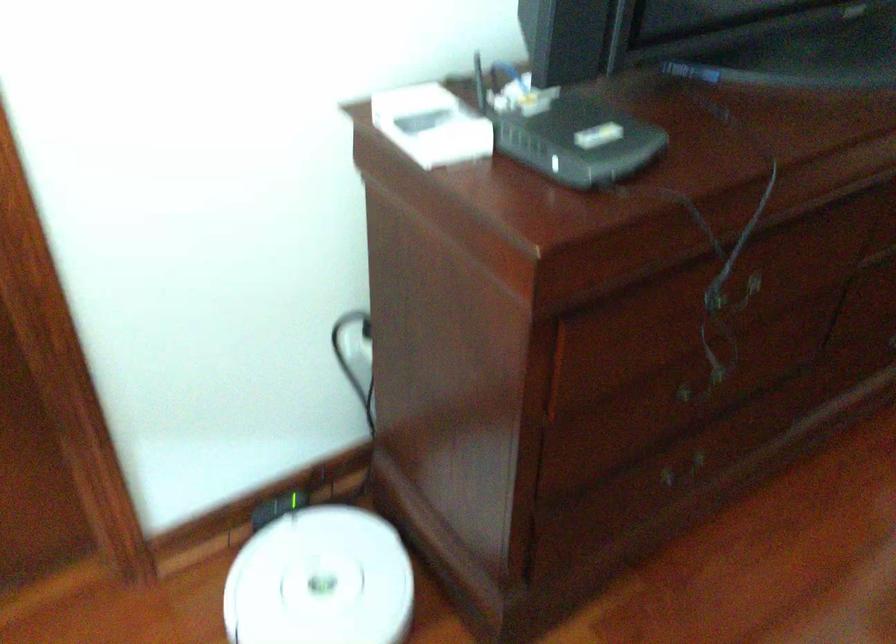
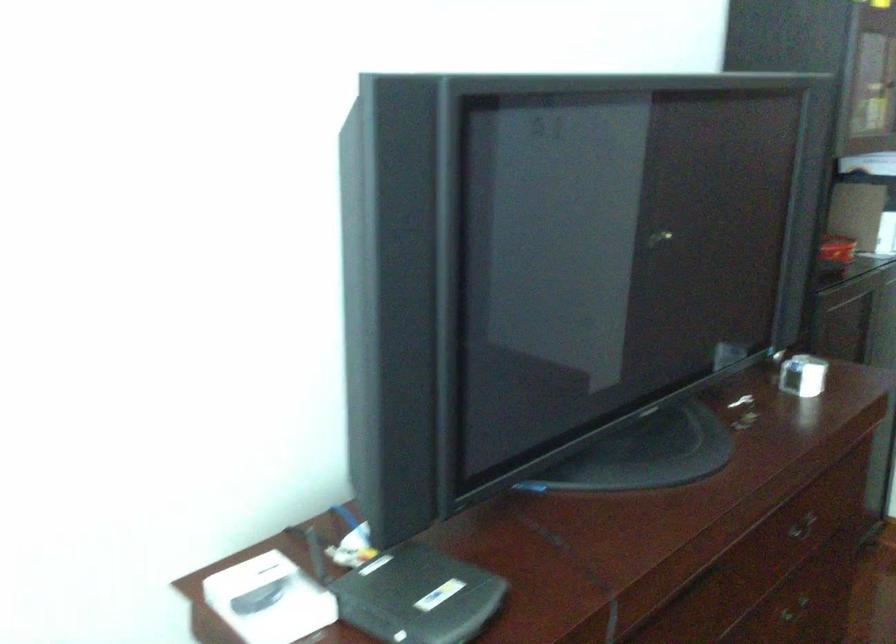
Question: The first image is from the beginning of the video and the second image is from the end. How did the camera likely rotate when shooting the video?

Choices:
 (A) Left
 (B) Right
 (C) Up
 (D) Down

Answer: (C)